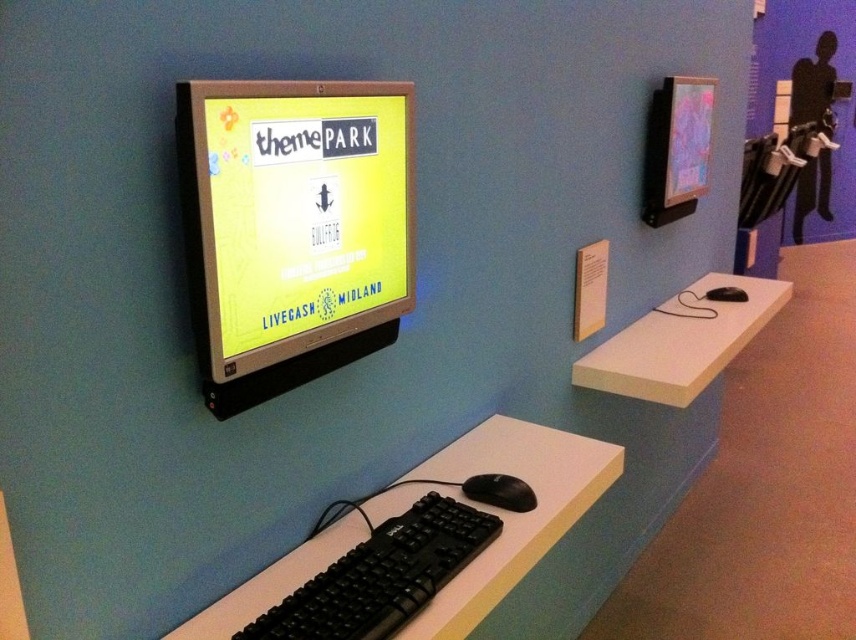
You are setting up a computer station for a presentation. You have two items at your disposal, the black plastic keyboard and mouse at lower center and the black matte mouse at lower center. Which item takes up more space on the desk?

The black plastic keyboard and mouse at lower center takes up more space on the desk because it is bigger than the black matte mouse at lower center.

You are a technician who needs to place both the black plastic keyboard and mouse at lower center and the black matte mouse at lower center on a shelf that can only hold items up to 10 cm in height. Which item will not fit?

The black plastic keyboard and mouse at lower center is much taller than the black matte mouse at lower center, so the black plastic keyboard and mouse at lower center will not fit on the shelf.

You are a visitor at this exhibit and want to interact with the matte black monitor at center. To do so, you need to use the black plastic keyboard and mouse at lower center. Can you reach the keyboard and mouse while sitting in front of the monitor?

The matte black monitor at center is above the black plastic keyboard and mouse at lower center, so yes, you can reach the keyboard and mouse while sitting in front of the monitor as they are positioned below it.